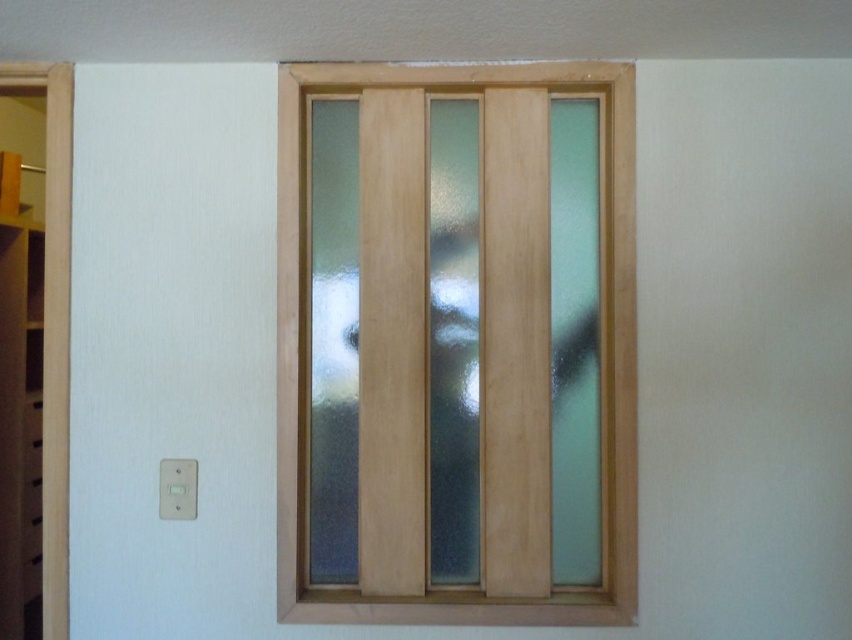
Is frosted glass door at center shorter than white wood door at left?

Yes, frosted glass door at center is shorter than white wood door at left.

This screenshot has height=640, width=852. What do you see at coordinates (605, 360) in the screenshot?
I see `frosted glass door at center` at bounding box center [605, 360].

Who is more forward, (465,65) or (22,76)?

Point (465,65)

The width and height of the screenshot is (852, 640). I want to click on frosted glass door at center, so click(x=605, y=360).